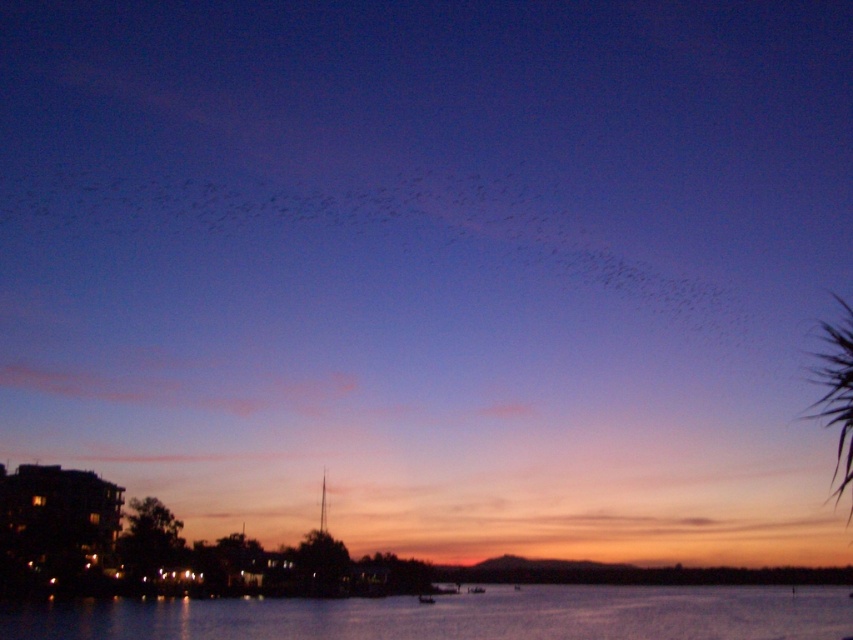
Is transparent water at lower center to the right of green leafy palm tree at upper right from the viewer's perspective?

In fact, transparent water at lower center is to the left of green leafy palm tree at upper right.

Is the position of transparent water at lower center more distant than that of green leafy palm tree at upper right?

That is True.

Which is behind, point (532, 616) or point (845, 464)?

The point (532, 616) is behind.

Locate an element on the screen. transparent water at lower center is located at coordinates (457, 616).

Is black matte birds at upper center positioned at the back of green leafy palm tree at upper right?

Yes, black matte birds at upper center is further from the viewer.

Identify the location of black matte birds at upper center. The height and width of the screenshot is (640, 853). (374, 227).

Is point (440, 240) closer to camera compared to point (143, 609)?

No, (440, 240) is further to viewer.

Which is in front, point (245, 204) or point (80, 618)?

Point (80, 618) is more forward.

Identify the location of black matte birds at upper center. The height and width of the screenshot is (640, 853). (374, 227).